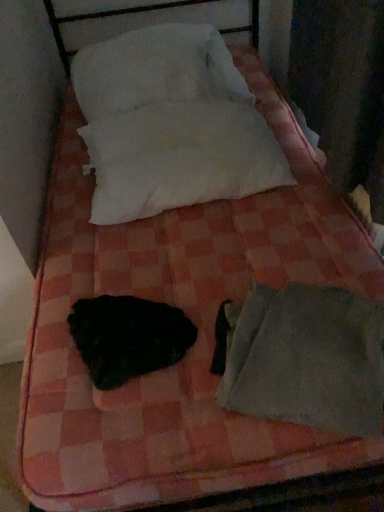
Question: Relative to black fuzzy animal at center, is white cotton pillow at upper center, the 2th pillow from the top, in front or behind?

Choices:
 (A) front
 (B) behind

Answer: (B)

Question: Looking at their shapes, would you say white cotton pillow at upper center, the 1th pillow when ordered from bottom to top, is wider or thinner than black fuzzy animal at center?

Choices:
 (A) wide
 (B) thin

Answer: (A)

Question: Which object is positioned farthest from the black fuzzy animal at center?

Choices:
 (A) gray fabric sleeping bag at lower right
 (B) white soft pillow at upper center, positioned as the second pillow in bottom-to-top order
 (C) white cotton pillow at upper center, the 2th pillow from the top

Answer: (B)

Question: Which is farther from the white cotton pillow at upper center, the 1th pillow when ordered from bottom to top?

Choices:
 (A) gray fabric sleeping bag at lower right
 (B) black fuzzy animal at center
 (C) white soft pillow at upper center, positioned as the 1th pillow in top-to-bottom order

Answer: (A)